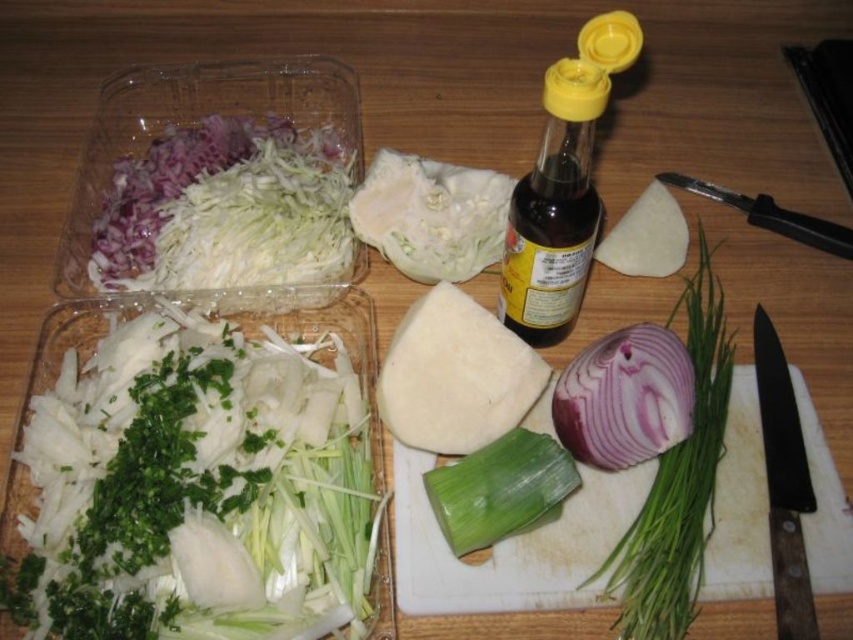
You are looking at the wooden surface with the two clear plastic containers and other ingredients. There are two points marked on the image. Which of the two points, point 1 at coordinates (199, 321) or point 2 at coordinates (440, 211), is closer to you?

Point 1 at coordinates (199, 321) is closer to the viewer than point 2 at coordinates (440, 211).

You are preparing a dish and need to chop some vegetables. You have a white shredded vegetable at lower left and a black plastic knife at upper right. Which object is positioned to the left of the other?

The white shredded vegetable at lower left is to the left of the black plastic knife at upper right.

You are preparing a dish and need to know which item is bigger between the white shredded vegetable at lower left and the black plastic knife at upper right. Can you tell me?

The white shredded vegetable at lower left is larger in size than the black plastic knife at upper right.